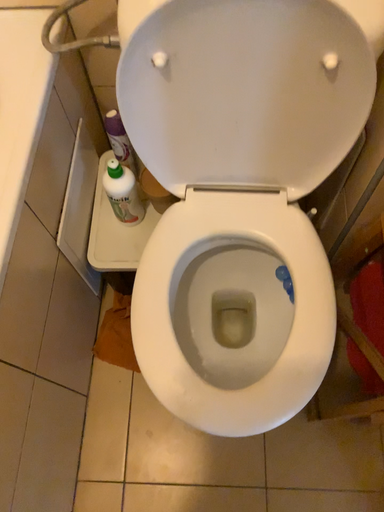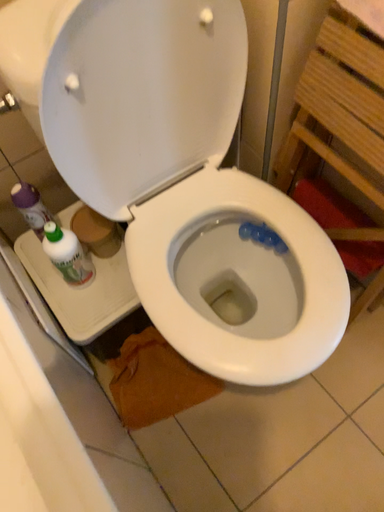
Question: How did the camera likely rotate when shooting the video?

Choices:
 (A) rotated upward
 (B) rotated downward

Answer: (A)